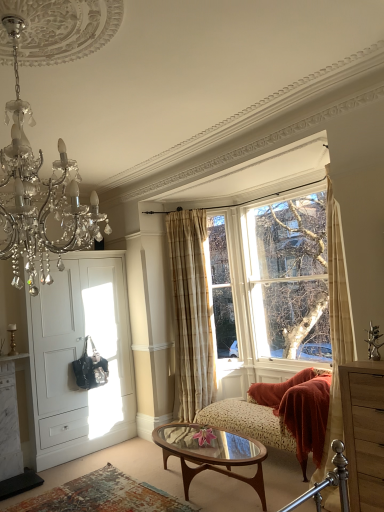
Question: Is beige plaid curtain at center positioned with its back to white matte door at left?

Choices:
 (A) no
 (B) yes

Answer: (A)

Question: Does beige plaid curtain at center appear on the left side of white matte door at left?

Choices:
 (A) no
 (B) yes

Answer: (A)

Question: From the image's perspective, is beige plaid curtain at center beneath white matte door at left?

Choices:
 (A) yes
 (B) no

Answer: (B)

Question: Considering the relative sizes of beige plaid curtain at center and white matte door at left in the image provided, is beige plaid curtain at center thinner than white matte door at left?

Choices:
 (A) no
 (B) yes

Answer: (B)

Question: From the image's perspective, is beige plaid curtain at center on top of white matte door at left?

Choices:
 (A) no
 (B) yes

Answer: (B)

Question: Is floral fabric studio couch at center to the left or to the right of beige plaid curtain at center in the image?

Choices:
 (A) left
 (B) right

Answer: (B)

Question: Considering the positions of floral fabric studio couch at center and beige plaid curtain at center in the image, is floral fabric studio couch at center wider or thinner than beige plaid curtain at center?

Choices:
 (A) thin
 (B) wide

Answer: (B)

Question: In the image, is floral fabric studio couch at center positioned in front of or behind beige plaid curtain at center?

Choices:
 (A) front
 (B) behind

Answer: (A)

Question: From a real-world perspective, is floral fabric studio couch at center above or below beige plaid curtain at center?

Choices:
 (A) below
 (B) above

Answer: (A)

Question: Looking at their shapes, would you say floral fabric studio couch at center is wider or thinner than crystal chandelier at upper left?

Choices:
 (A) wide
 (B) thin

Answer: (B)

Question: Is floral fabric studio couch at center situated inside crystal chandelier at upper left or outside?

Choices:
 (A) inside
 (B) outside

Answer: (B)

Question: From the image's perspective, is floral fabric studio couch at center located above or below crystal chandelier at upper left?

Choices:
 (A) below
 (B) above

Answer: (A)

Question: Is floral fabric studio couch at center in front of or behind crystal chandelier at upper left in the image?

Choices:
 (A) behind
 (B) front

Answer: (A)

Question: Is white matte door at left in front of or behind translucent glass coffee table at center in the image?

Choices:
 (A) behind
 (B) front

Answer: (A)

Question: Does point (79, 419) appear closer or farther from the camera than point (213, 463)?

Choices:
 (A) closer
 (B) farther

Answer: (B)